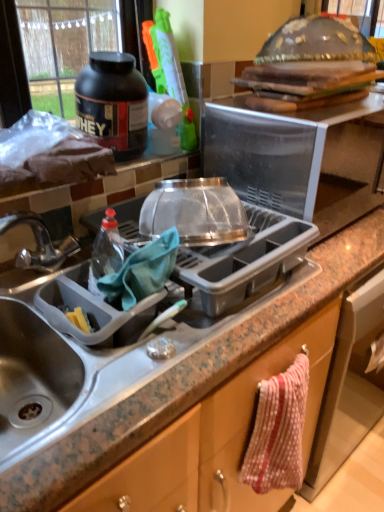
Find the location of a particular element. This screenshot has height=512, width=384. granite gray sink at lower left is located at coordinates [292, 302].

What is the approximate width of granite gray sink at lower left?

The width of granite gray sink at lower left is 20.88 inches.

Describe the element at coordinates (251, 415) in the screenshot. The height and width of the screenshot is (512, 384). I see `polka dot fabric towel at lower right` at that location.

Describe the element at coordinates (66, 359) in the screenshot. I see `metallic sink at left` at that location.

In order to face metallic sink at left, should I rotate leftwards or rightwards?

To face it directly, rotate left by 12.243 degrees.

Find the location of a particular element. Image resolution: width=384 pixels, height=512 pixels. clear plastic dish rack at center, the 2th appliance when ordered from top to bottom is located at coordinates (245, 259).

In the image, is transparent plastic microwave at upper center, marked as the 2th appliance in a bottom-to-top arrangement, on the left side or the right side of clear plastic dish rack at center, acting as the first appliance starting from the bottom?

From the image, it's evident that transparent plastic microwave at upper center, marked as the 2th appliance in a bottom-to-top arrangement, is to the right of clear plastic dish rack at center, acting as the first appliance starting from the bottom.

Image resolution: width=384 pixels, height=512 pixels. I want to click on appliance located behind the clear plastic dish rack at center, acting as the first appliance starting from the bottom, so click(x=297, y=158).

Who is taller, transparent plastic microwave at upper center, placed as the first appliance when sorted from top to bottom, or clear plastic dish rack at center, the 2th appliance when ordered from top to bottom?

Standing taller between the two is transparent plastic microwave at upper center, placed as the first appliance when sorted from top to bottom.

Which of these two, transparent plastic microwave at upper center, placed as the first appliance when sorted from top to bottom, or clear plastic dish rack at center, the 2th appliance when ordered from top to bottom, is thinner?

With smaller width is clear plastic dish rack at center, the 2th appliance when ordered from top to bottom.

Is polka dot fabric towel at lower right at the back of transparent plastic microwave at upper center, marked as the 2th appliance in a bottom-to-top arrangement?

transparent plastic microwave at upper center, marked as the 2th appliance in a bottom-to-top arrangement, is not turned away from polka dot fabric towel at lower right.

There is a polka dot fabric towel at lower right. Identify the location of the 2nd appliance above it (from a real-world perspective). This screenshot has height=512, width=384. (297, 158).

Does transparent plastic microwave at upper center, placed as the first appliance when sorted from top to bottom, have a greater width compared to polka dot fabric towel at lower right?

Yes, transparent plastic microwave at upper center, placed as the first appliance when sorted from top to bottom, is wider than polka dot fabric towel at lower right.

Between transparent plastic microwave at upper center, marked as the 2th appliance in a bottom-to-top arrangement, and polka dot fabric towel at lower right, which one appears on the left side from the viewer's perspective?

Positioned to the left is polka dot fabric towel at lower right.

Consider the image. From a real-world perspective, is polka dot fabric towel at lower right over clear plastic dish rack at center, the 2th appliance when ordered from top to bottom?

No, from a real-world perspective, polka dot fabric towel at lower right is not over clear plastic dish rack at center, the 2th appliance when ordered from top to bottom

Considering the relative sizes of polka dot fabric towel at lower right and clear plastic dish rack at center, the 2th appliance when ordered from top to bottom, in the image provided, is polka dot fabric towel at lower right taller than clear plastic dish rack at center, the 2th appliance when ordered from top to bottom,?

Indeed, polka dot fabric towel at lower right has a greater height compared to clear plastic dish rack at center, the 2th appliance when ordered from top to bottom.

Is polka dot fabric towel at lower right positioned with its back to clear plastic dish rack at center, the 2th appliance when ordered from top to bottom?

No, polka dot fabric towel at lower right is not facing the opposite direction of clear plastic dish rack at center, the 2th appliance when ordered from top to bottom.

What are the coordinates of `appliance lying on the left of polka dot fabric towel at lower right` in the screenshot? It's located at (245, 259).

From a real-world perspective, which object stands above the other?

black matte protein powder container at upper left, from a real-world perspective.

From the image's perspective, is black matte protein powder container at upper left under metallic sink at left?

Incorrect, from the image's perspective, black matte protein powder container at upper left is higher than metallic sink at left.

Is black matte protein powder container at upper left looking in the opposite direction of metallic sink at left?

No, black matte protein powder container at upper left is not facing the opposite direction of metallic sink at left.

Between clear plastic dish rack at center, acting as the first appliance starting from the bottom, and granite gray sink at lower left, which one appears on the right side from the viewer's perspective?

Result: clear plastic dish rack at center, acting as the first appliance starting from the bottom.

Looking at their sizes, would you say clear plastic dish rack at center, acting as the first appliance starting from the bottom, is wider or thinner than granite gray sink at lower left?

clear plastic dish rack at center, acting as the first appliance starting from the bottom, is thinner than granite gray sink at lower left.

Which of these two, clear plastic dish rack at center, the 2th appliance when ordered from top to bottom, or granite gray sink at lower left, stands shorter?

clear plastic dish rack at center, the 2th appliance when ordered from top to bottom, is shorter.

How different are the orientations of clear plastic dish rack at center, the 2th appliance when ordered from top to bottom, and granite gray sink at lower left in degrees?

The angle between the facing direction of clear plastic dish rack at center, the 2th appliance when ordered from top to bottom, and the facing direction of granite gray sink at lower left is 1.6 degrees.

Identify the location of countertop lying in front of the polka dot fabric towel at lower right. (292, 302).

Choose the correct answer: Is polka dot fabric towel at lower right inside granite gray sink at lower left or outside it?

polka dot fabric towel at lower right cannot be found inside granite gray sink at lower left.

How many degrees apart are the facing directions of polka dot fabric towel at lower right and granite gray sink at lower left?

The angle between the facing direction of polka dot fabric towel at lower right and the facing direction of granite gray sink at lower left is 3.14 degrees.

Is granite gray sink at lower left at the back of polka dot fabric towel at lower right?

Correct, polka dot fabric towel at lower right is looking away from granite gray sink at lower left.

Is metallic sink at left positioned with its back to clear plastic dish rack at center, the 2th appliance when ordered from top to bottom?

No.

Which point is more distant from viewer, (99,389) or (252,212)?

The point (252,212) is farther.

Considering the relative positions of metallic sink at left and clear plastic dish rack at center, the 2th appliance when ordered from top to bottom, in the image provided, is metallic sink at left to the left of clear plastic dish rack at center, the 2th appliance when ordered from top to bottom, from the viewer's perspective?

Correct, you'll find metallic sink at left to the left of clear plastic dish rack at center, the 2th appliance when ordered from top to bottom.

Identify the location of appliance to the right of clear plastic dish rack at center, the 2th appliance when ordered from top to bottom. (297, 158).

You are a GUI agent. You are given a task and a screenshot of the screen. Output one action in this format:
    pyautogui.click(x=<x>, y=<y>)
    Task: Click on the cabinetry below the transparent plastic microwave at upper center, placed as the first appliance when sorted from top to bottom (from the image's perspective)
    
    Given the screenshot: What is the action you would take?
    pyautogui.click(x=251, y=415)

Considering their positions, is metallic sink at left positioned further to clear plastic dish rack at center, the 2th appliance when ordered from top to bottom, than polka dot fabric towel at lower right?

The object further to clear plastic dish rack at center, the 2th appliance when ordered from top to bottom, is polka dot fabric towel at lower right.

Based on their spatial positions, is polka dot fabric towel at lower right or transparent plastic microwave at upper center, placed as the first appliance when sorted from top to bottom, closer to clear plastic dish rack at center, acting as the first appliance starting from the bottom?

polka dot fabric towel at lower right.

When comparing their distances from polka dot fabric towel at lower right, does black matte protein powder container at upper left or clear plastic dish rack at center, acting as the first appliance starting from the bottom, seem closer?

clear plastic dish rack at center, acting as the first appliance starting from the bottom, is closer to polka dot fabric towel at lower right.

Estimate the real-world distances between objects in this image. Which object is closer to granite gray sink at lower left, clear plastic dish rack at center, the 2th appliance when ordered from top to bottom, or metallic sink at left?

clear plastic dish rack at center, the 2th appliance when ordered from top to bottom, lies closer to granite gray sink at lower left than the other object.

Which object lies nearer to the anchor point polka dot fabric towel at lower right, granite gray sink at lower left or transparent plastic microwave at upper center, marked as the 2th appliance in a bottom-to-top arrangement?

granite gray sink at lower left lies closer to polka dot fabric towel at lower right than the other object.

Considering their positions, is transparent plastic microwave at upper center, placed as the first appliance when sorted from top to bottom, positioned closer to clear plastic dish rack at center, acting as the first appliance starting from the bottom, than black matte protein powder container at upper left?

transparent plastic microwave at upper center, placed as the first appliance when sorted from top to bottom, lies closer to clear plastic dish rack at center, acting as the first appliance starting from the bottom, than the other object.

Looking at the image, which one is located further to transparent plastic microwave at upper center, placed as the first appliance when sorted from top to bottom, polka dot fabric towel at lower right or clear plastic dish rack at center, acting as the first appliance starting from the bottom?

polka dot fabric towel at lower right lies further to transparent plastic microwave at upper center, placed as the first appliance when sorted from top to bottom, than the other object.

Considering their positions, is polka dot fabric towel at lower right positioned closer to clear plastic dish rack at center, the 2th appliance when ordered from top to bottom, than metallic sink at left?

The object closer to clear plastic dish rack at center, the 2th appliance when ordered from top to bottom, is metallic sink at left.

Find the location of a particular element. The height and width of the screenshot is (512, 384). countertop between transparent plastic microwave at upper center, placed as the first appliance when sorted from top to bottom, and polka dot fabric towel at lower right, in the vertical direction is located at coordinates (292, 302).

This screenshot has width=384, height=512. I want to click on appliance between metallic sink at left and transparent plastic microwave at upper center, placed as the first appliance when sorted from top to bottom, so click(245, 259).

The width and height of the screenshot is (384, 512). I want to click on countertop between metallic sink at left and clear plastic dish rack at center, acting as the first appliance starting from the bottom, so click(x=292, y=302).

Locate an element on the screen. countertop between clear plastic dish rack at center, the 2th appliance when ordered from top to bottom, and polka dot fabric towel at lower right, in the vertical direction is located at coordinates (292, 302).